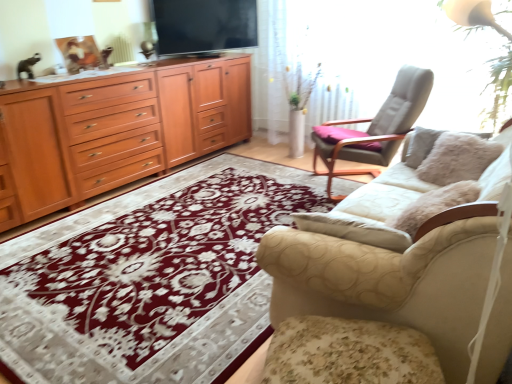
Locate an element on the screen. The image size is (512, 384). vacant space situated above floral fabric footrest at lower right (from a real-world perspective) is located at coordinates (358, 360).